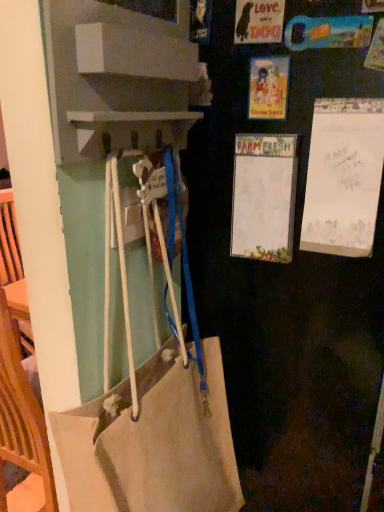
Image resolution: width=384 pixels, height=512 pixels. What do you see at coordinates (150, 403) in the screenshot?
I see `canvas tote bag at center` at bounding box center [150, 403].

Measure the distance between point (140, 402) and camera.

Point (140, 402) and camera are 24.72 inches apart.

Image resolution: width=384 pixels, height=512 pixels. What are the coordinates of `canvas tote bag at center` in the screenshot? It's located at (150, 403).

What is the approximate height of canvas tote bag at center?

The height of canvas tote bag at center is 31.06 inches.

Locate an element on the screen. The height and width of the screenshot is (512, 384). canvas tote bag at center is located at coordinates coord(150,403).